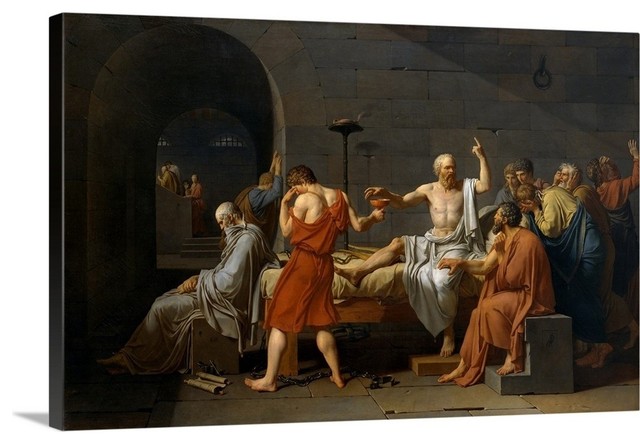
Identify the location of blue robe. (579, 278).